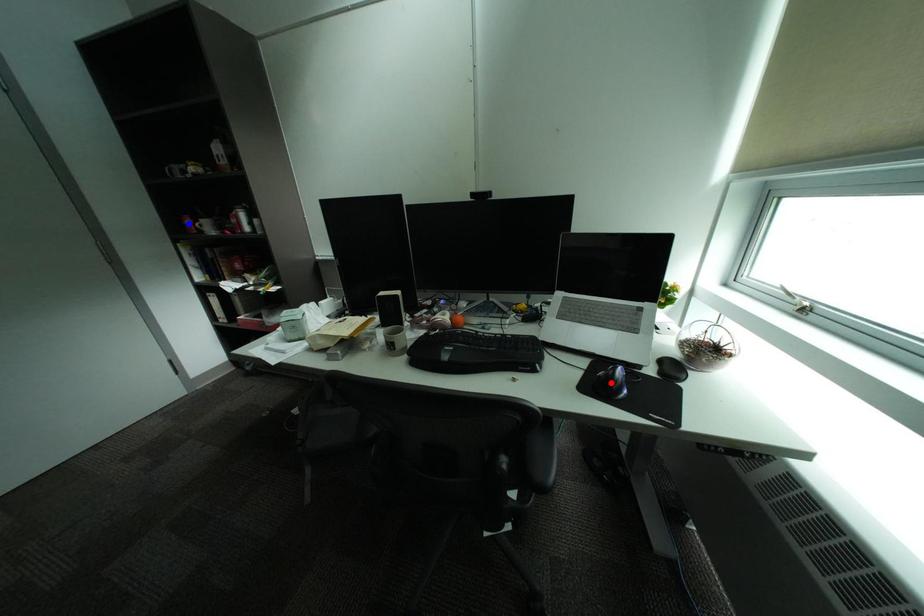
Question: In the image, two points are highlighted. Which point is nearer to the camera? Reply with the corresponding letter.

Choices:
 (A) blue point
 (B) red point

Answer: (B)